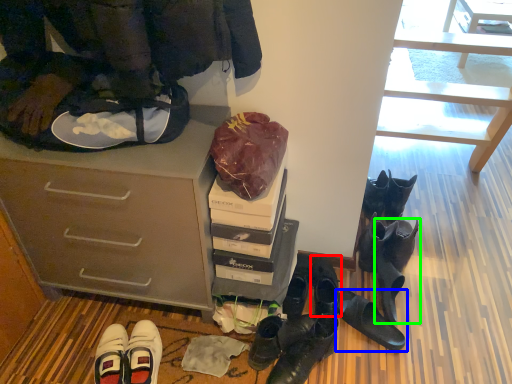
Question: Based on their relative distances, which object is farther from footwear (highlighted by a red box)? Choose from footwear (highlighted by a blue box) and footwear (highlighted by a green box).

Choices:
 (A) footwear
 (B) footwear

Answer: (B)